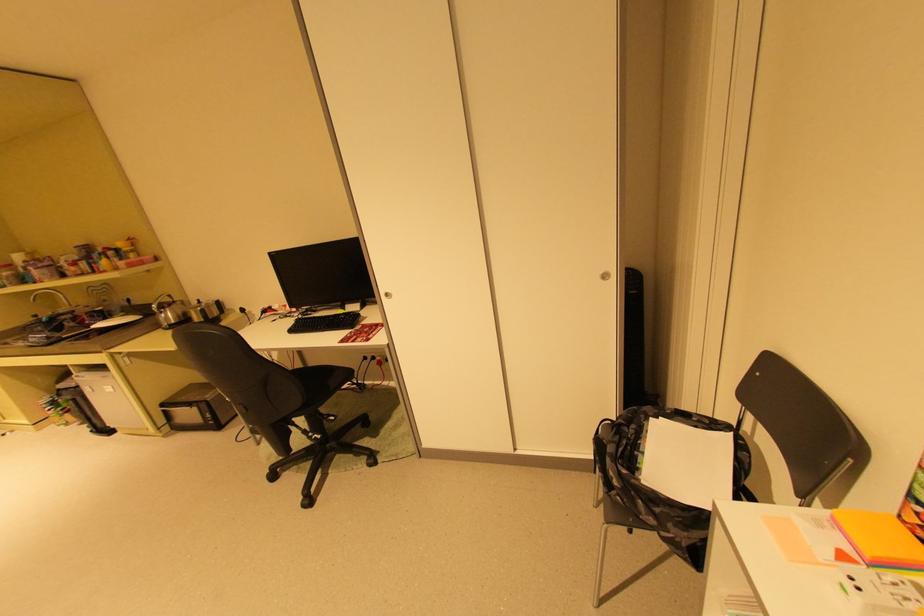
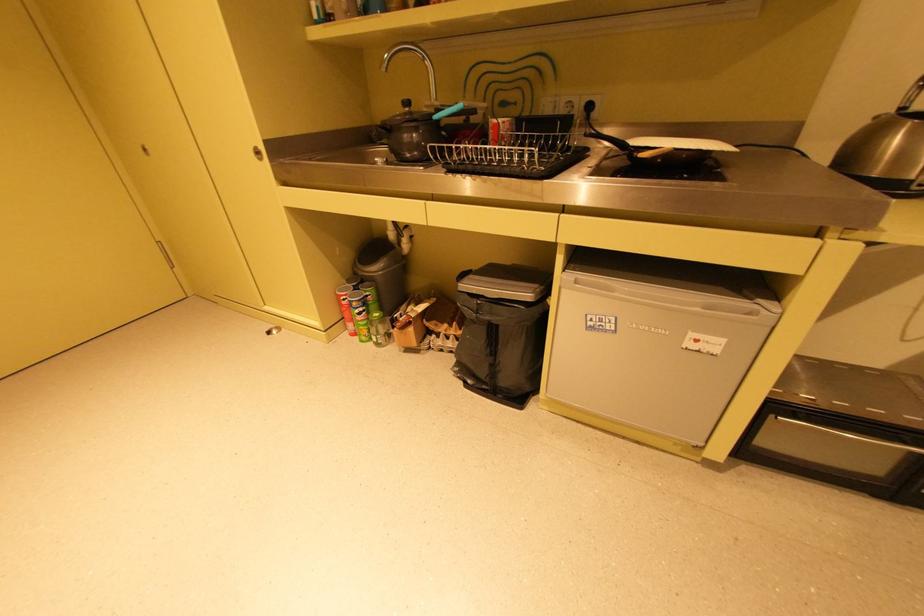
Which direction would the cameraman need to move to produce the second image?

The cameraman walked toward left, forward.